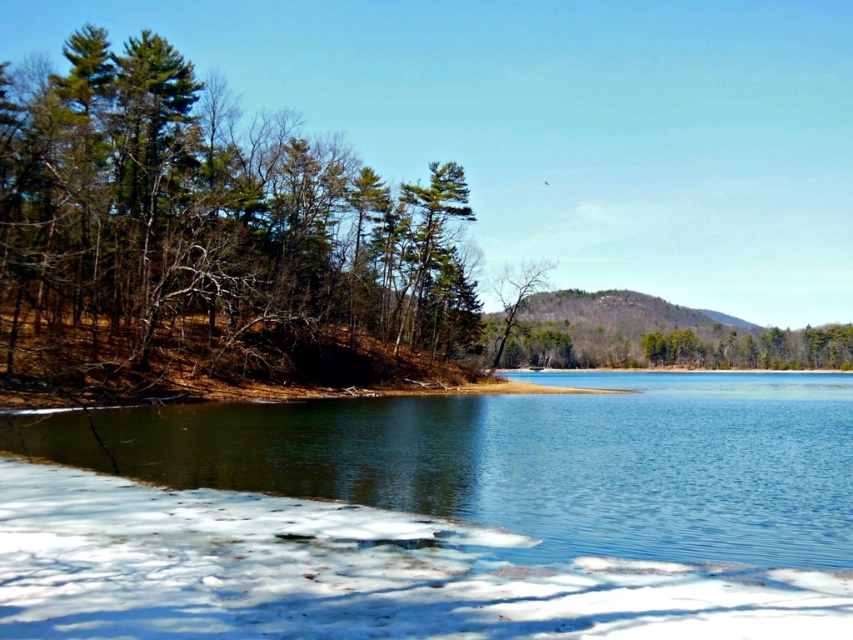
Question: Is clear water at lower center to the left of white fluffy snow at lower left from the viewer's perspective?

Choices:
 (A) no
 (B) yes

Answer: (A)

Question: Which point is farther to the camera?

Choices:
 (A) green textured trees at left
 (B) bare branches at center

Answer: (B)

Question: Does green textured trees at left have a smaller size compared to white fluffy snow at lower left?

Choices:
 (A) yes
 (B) no

Answer: (B)

Question: Which of these objects is positioned closest to the white fluffy snow at lower left?

Choices:
 (A) green textured trees at left
 (B) clear water at lower center
 (C) bare branches at center

Answer: (B)

Question: Does green textured trees at left have a greater width compared to clear water at lower center?

Choices:
 (A) yes
 (B) no

Answer: (B)

Question: Which of the following is the farthest from the observer?

Choices:
 (A) clear water at lower center
 (B) white fluffy snow at lower left

Answer: (A)